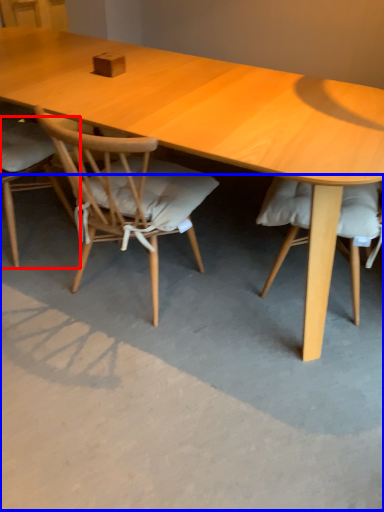
Question: Which object appears farthest to the camera in this image, chair (highlighted by a red box) or concrete (highlighted by a blue box)?

Choices:
 (A) chair
 (B) concrete

Answer: (A)